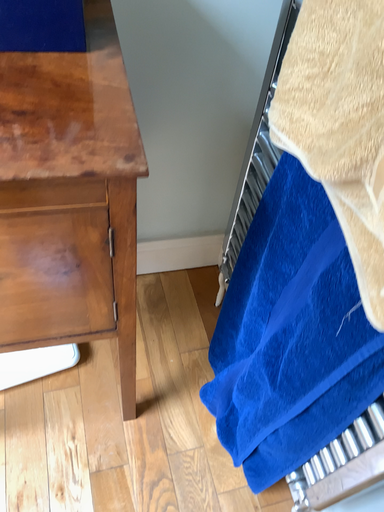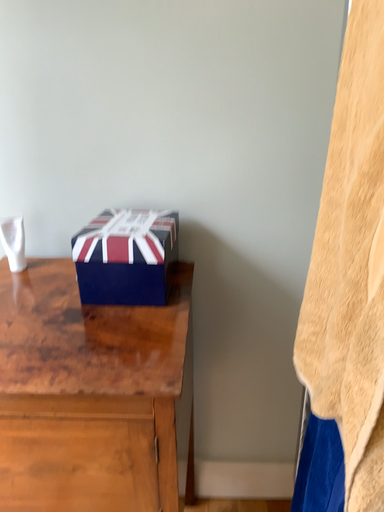
Question: Which way did the camera rotate in the video?

Choices:
 (A) rotated upward
 (B) rotated downward

Answer: (A)